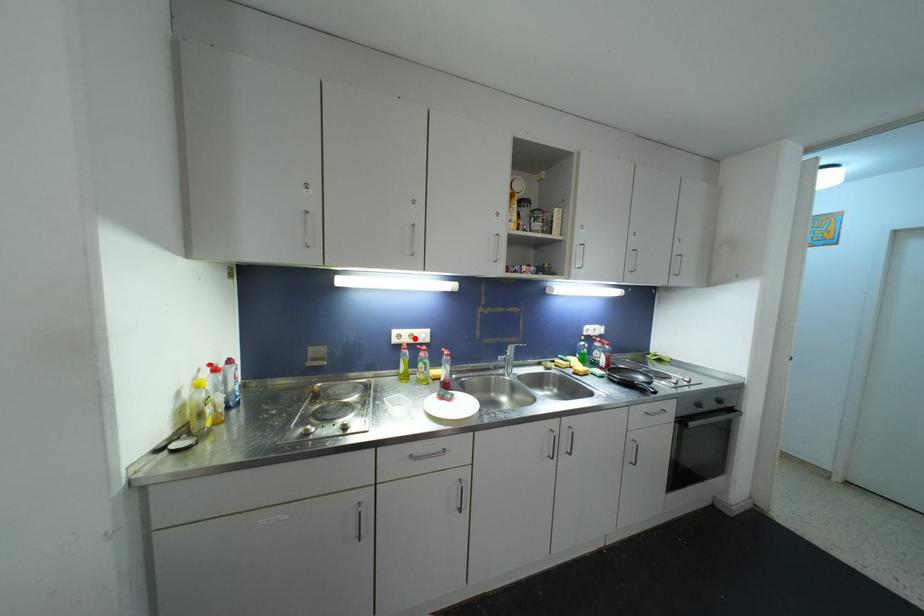
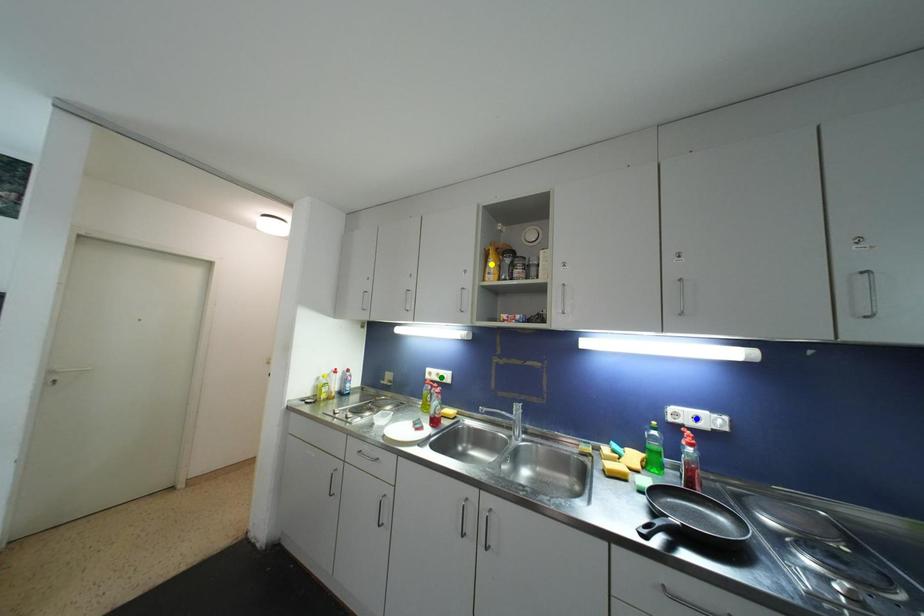
Question: I am providing you with two images of the same scene from different viewpoints. A red point is marked on the first image. You are given multiple points on the second image. Which point in image 2 is actually the same real-world point as the red point in image 1?

Choices:
 (A) green point
 (B) blue point
 (C) yellow point

Answer: (A)